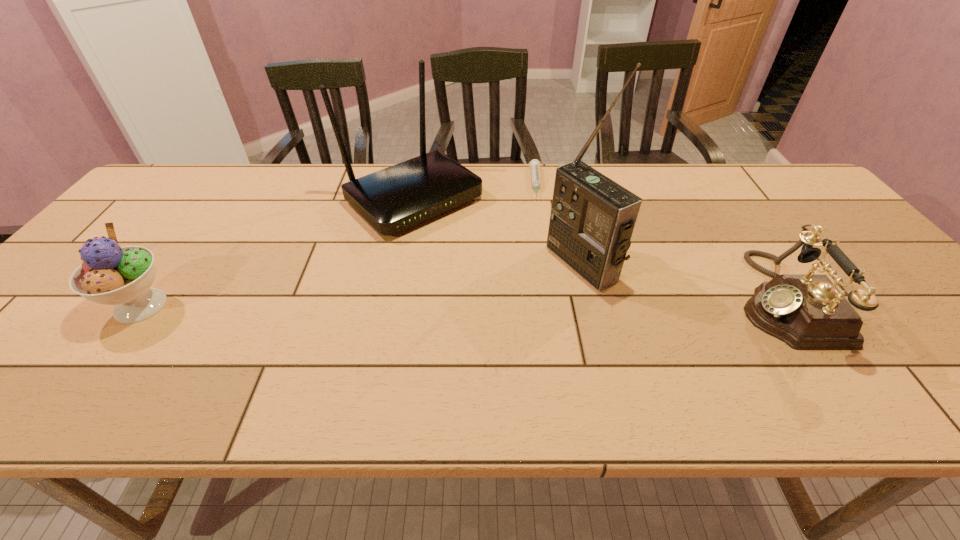
This screenshot has height=540, width=960. What are the coordinates of `vacant spot on the desktop that is between the icecream and the rightmost object and is positioned on the display of the tallest object` in the screenshot? It's located at (503, 302).

Where is `free spot on the desktop that is between the icecream and the rightmost object and is positioned on the front-facing side of the second object from left to right`? The width and height of the screenshot is (960, 540). free spot on the desktop that is between the icecream and the rightmost object and is positioned on the front-facing side of the second object from left to right is located at coordinates (539, 302).

Image resolution: width=960 pixels, height=540 pixels. Identify the location of vacant spot on the desktop that is between the leftmost object and the telephone and is positioned at the needle end of the shortest object. (545, 302).